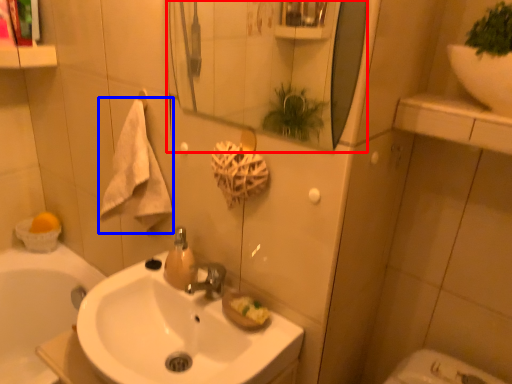
Question: Among these objects, which one is nearest to the camera, mirror (highlighted by a red box) or bath towel (highlighted by a blue box)?

Choices:
 (A) mirror
 (B) bath towel

Answer: (A)